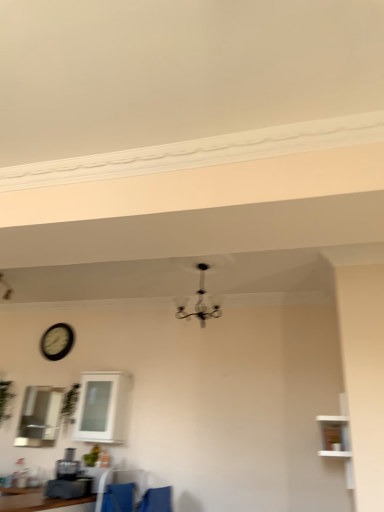
Question: From the image's perspective, is clear glass cabinet at upper left, which appears as the second window when viewed from the right, located above or below blue fabric armchair at lower center?

Choices:
 (A) below
 (B) above

Answer: (B)

Question: Is clear glass cabinet at upper left, positioned as the first window in left-to-right order, taller or shorter than blue fabric armchair at lower center?

Choices:
 (A) short
 (B) tall

Answer: (B)

Question: Estimate the real-world distances between objects in this image. Which object is closer to the green leafy plant at center, positioned as the 1th plant in right-to-left order?

Choices:
 (A) black glass chandelier at center
 (B) clear glass cabinet at upper left, positioned as the first window in left-to-right order
 (C) blue fabric armchair at lower center
 (D) green leafy plant at left, the 2th plant when ordered from right to left
 (E) white glossy cabinet at center, which ranks as the 2th window in left-to-right order

Answer: (B)

Question: Which object is positioned closest to the matte black coffee machine at lower left?

Choices:
 (A) green leafy plant at center, which appears as the second plant when viewed from the left
 (B) black glass chandelier at center
 (C) white wooden shelf at right
 (D) green leafy plant at left, marked as the first plant in a left-to-right arrangement
 (E) blue fabric armchair at lower center

Answer: (E)